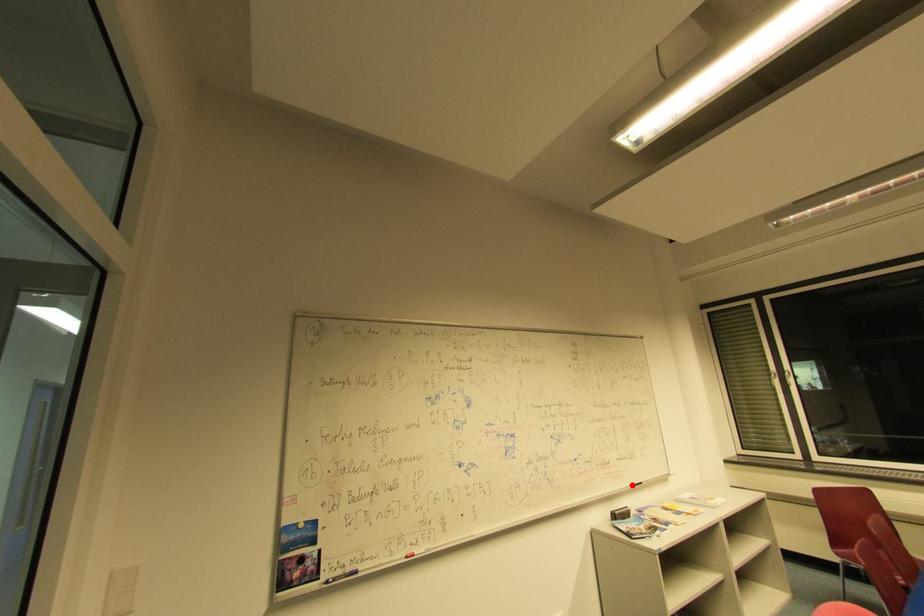
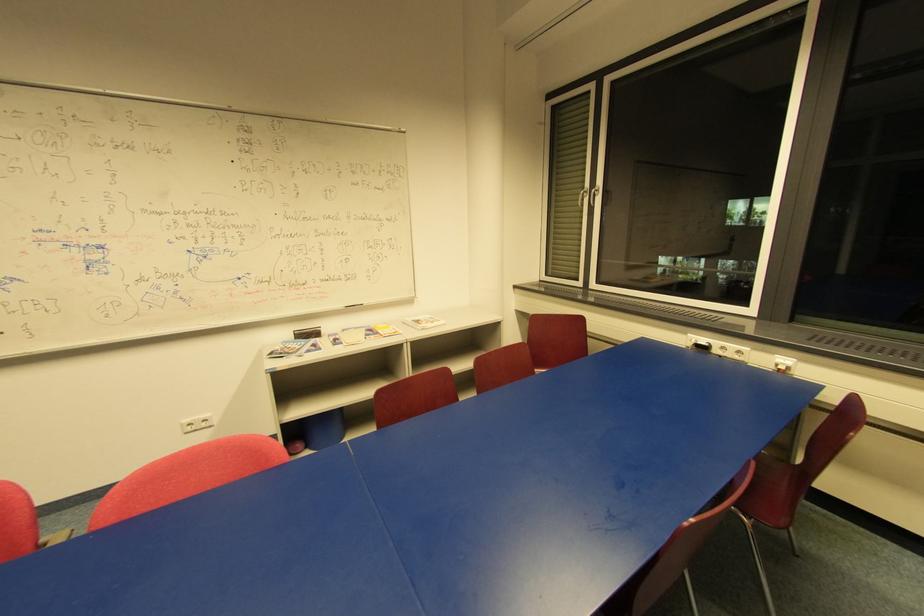
Question: I am providing you with two images of the same scene from different viewpoints. Image1 has a red point marked. In image2, the corresponding 3D location appears at what relative position? Reply with the corresponding letter.

Choices:
 (A) Closer
 (B) Farther

Answer: (A)